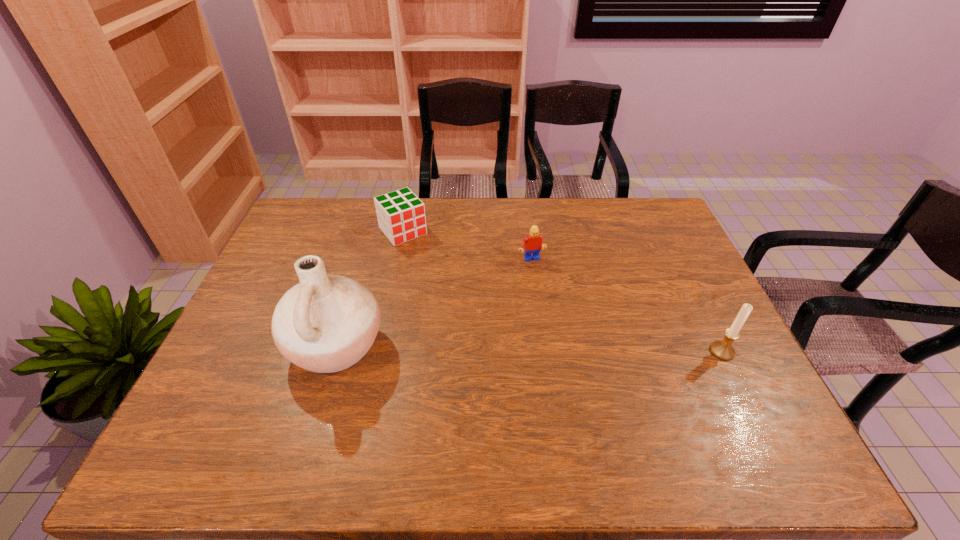
Identify the location of vacant area that lies between the second farthest object and the farthest object. This screenshot has width=960, height=540. (467, 245).

Where is `unoccupied position between the cube and the second object from right to left`? unoccupied position between the cube and the second object from right to left is located at coordinates (467, 245).

In order to click on vacant area that lies between the farthest object and the pottery in this screenshot , I will do `click(370, 288)`.

The width and height of the screenshot is (960, 540). In order to click on free space between the candle holder and the tallest object in this screenshot , I will do `click(529, 349)`.

The image size is (960, 540). Identify the location of vacant space in between the third shortest object and the third nearest object. (627, 306).

I want to click on vacant region between the cube and the second object from right to left, so click(x=467, y=245).

Identify which object is located as the nearest to the farthest object. Please provide its 2D coordinates. Your answer should be formatted as a tuple, i.e. [(x, y)], where the tuple contains the x and y coordinates of a point satisfying the conditions above.

[(326, 323)]

The width and height of the screenshot is (960, 540). Identify the location of the closest object relative to the candle holder. click(532, 243).

In order to click on vacant position in the image that satisfies the following two spatial constraints: 1. on the front side of the farthest object; 2. on the right side of the rightmost object in this screenshot , I will do `click(378, 352)`.